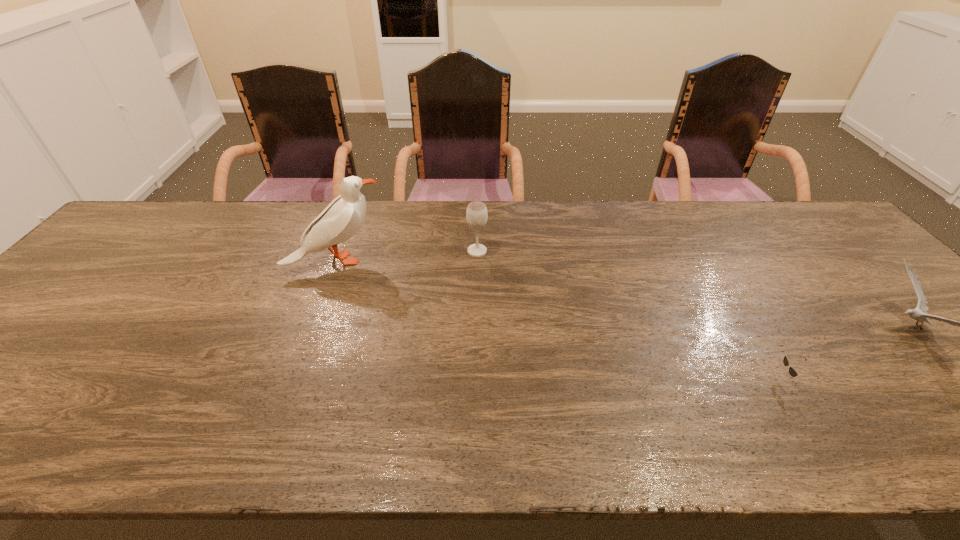
Locate an element on the screen. This screenshot has height=540, width=960. the leftmost object is located at coordinates (343, 217).

Find the location of a particular element. the farther gull is located at coordinates (343, 217).

This screenshot has width=960, height=540. Find the location of `the second object from left to right`. the second object from left to right is located at coordinates (476, 214).

Where is `the third shortest object`? Image resolution: width=960 pixels, height=540 pixels. the third shortest object is located at coordinates (476, 214).

At what (x,y) coordinates should I click in order to perform the action: click on the shortest object. Please return your answer as a coordinate pair (x, y). Image resolution: width=960 pixels, height=540 pixels. Looking at the image, I should click on (792, 371).

Where is `sunglasses`? This screenshot has height=540, width=960. sunglasses is located at coordinates (792, 371).

I want to click on free space located 0.250m at the beak of the leftmost object, so click(x=471, y=260).

Identify the location of free region located 0.130m on the back of the third object from right to left. pyautogui.click(x=477, y=220).

Identify the location of free region located in front of the lenses of the second object from right to left. (737, 379).

In order to click on free location located in front of the lenses of the second object from right to left in this screenshot , I will do `click(604, 379)`.